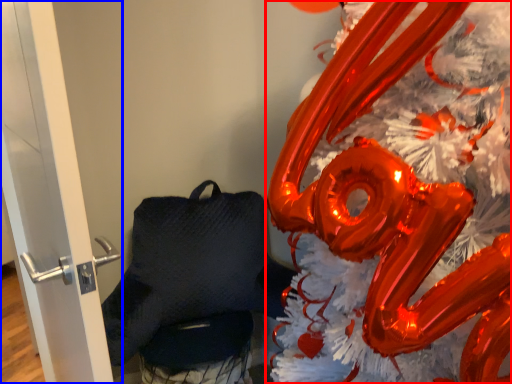
Question: Which of the following is the closest to the observer, christmas decoration (highlighted by a red box) or door (highlighted by a blue box)?

Choices:
 (A) christmas decoration
 (B) door

Answer: (A)